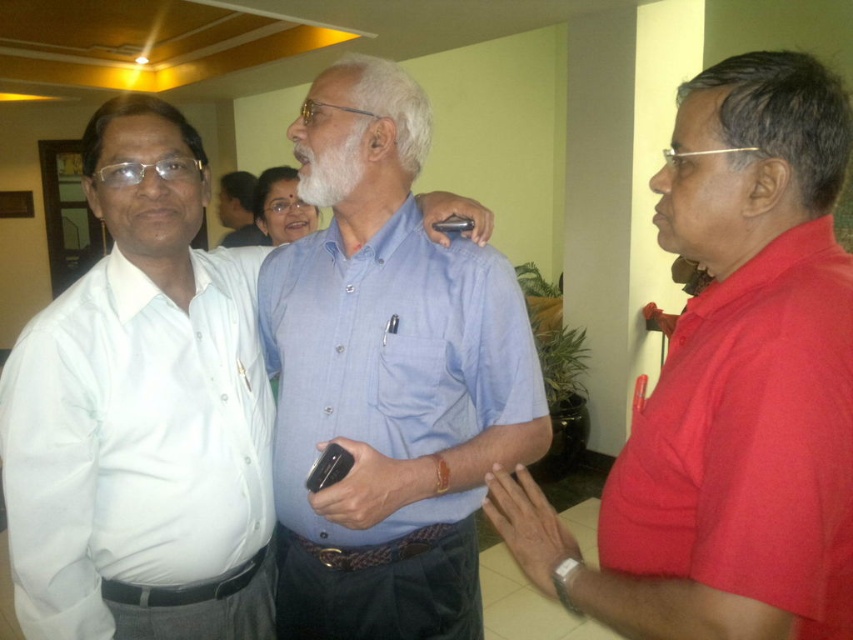
You are standing in the room and want to take a photo of the point at coordinates (701, 516). If your camera has a focal length of 50mm and you need to be exactly 1 meter away to get a clear shot, should you move closer or farther away?

The point at coordinates (701, 516) is currently 78.68 centimeters away from the camera. Since you need to be 1 meter away for a clear shot, you should move farther away to increase the distance to 1 meter.

You are a photographer in the room and want to take a photo of both the matte blue shirt at center and the blue cotton shirt at center. Which one should you focus on first if you want to capture them both clearly?

The matte blue shirt at center is positioned on the left side of blue cotton shirt at center, so you should focus on the matte blue shirt at center first to ensure both are in the frame.

You are standing in the room and want to hand a document to the person wearing the red matte shirt at right. Based on their position, in which general direction should you move to reach them?

The red matte shirt at right is located at coordinates approximately 0.605 on the x axis and 0.857 on the y axis, so you should move towards the lower right direction to reach them.